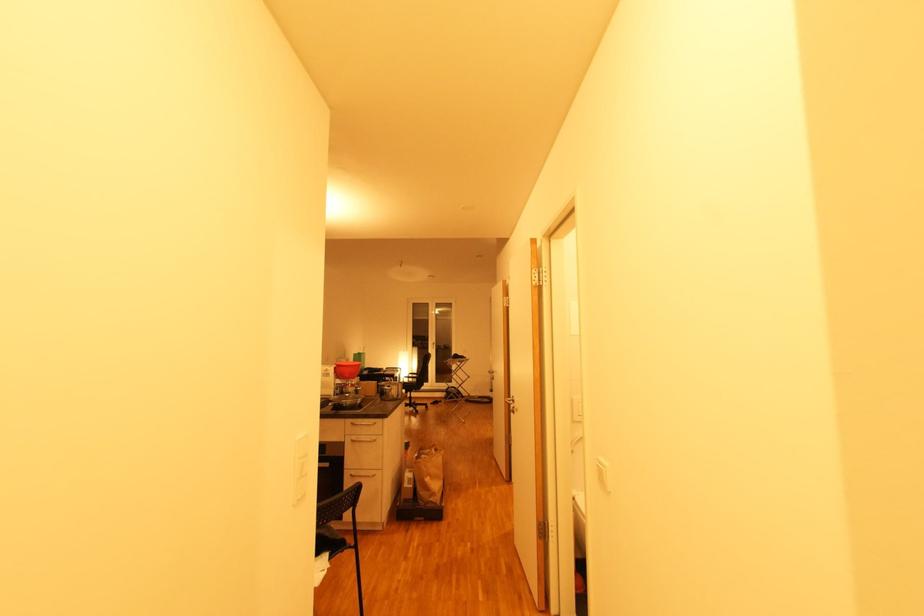
This screenshot has height=616, width=924. What are the coordinates of `white light switch` in the screenshot? It's located at (299, 468).